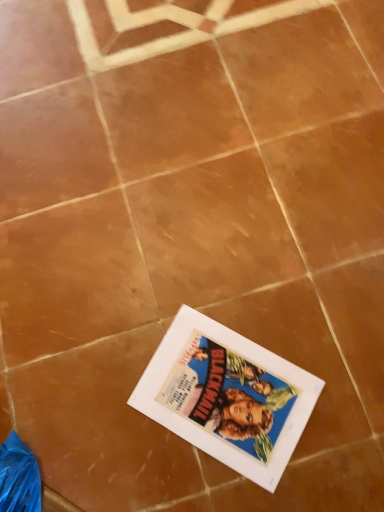
You are a GUI agent. You are given a task and a screenshot of the screen. Output one action in this format:
    pyautogui.click(x=<x>, y=<y>)
    Task: Click on the vacant space behind matte paper book cover at center
    The image size is (384, 512).
    Given the screenshot: What is the action you would take?
    pyautogui.click(x=193, y=278)